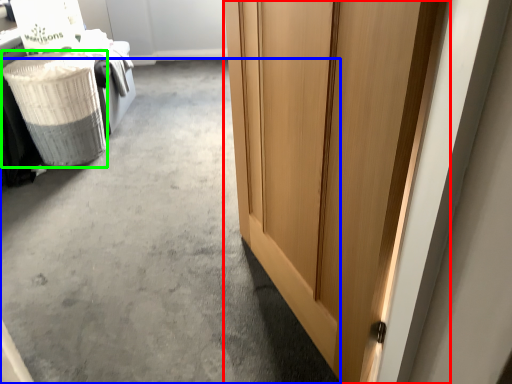
Question: Based on their relative distances, which object is nearer to door (highlighted by a red box)? Choose from concrete (highlighted by a blue box) and laundry basket (highlighted by a green box).

Choices:
 (A) concrete
 (B) laundry basket

Answer: (A)